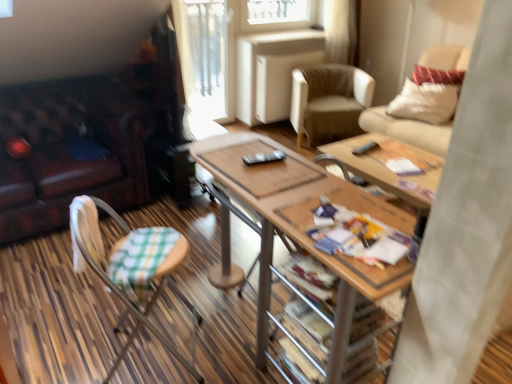
Identify the location of vacant region below green checkered fabric chair at lower left, which is the 3th chair in right-to-left order (from a real-world perspective). The image size is (512, 384). (154, 353).